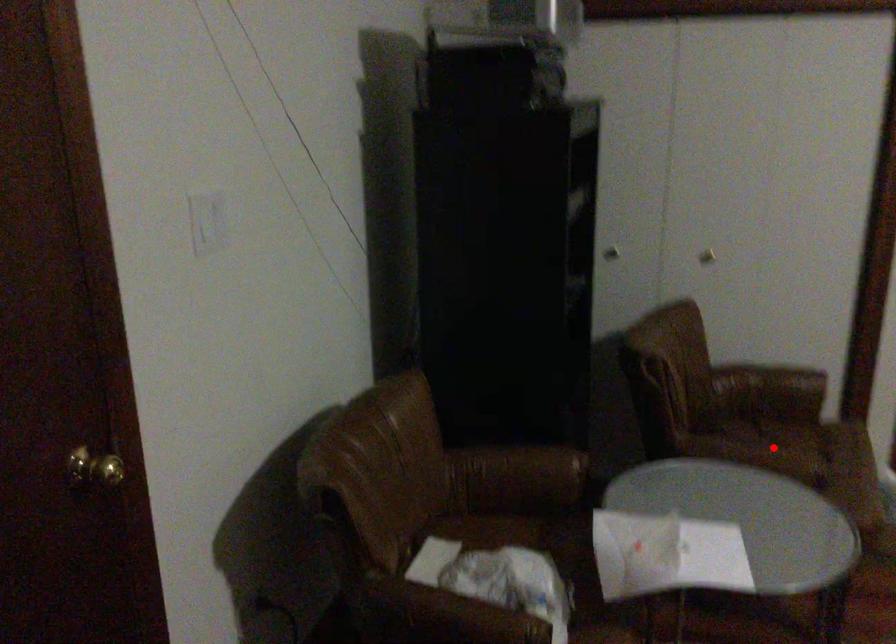
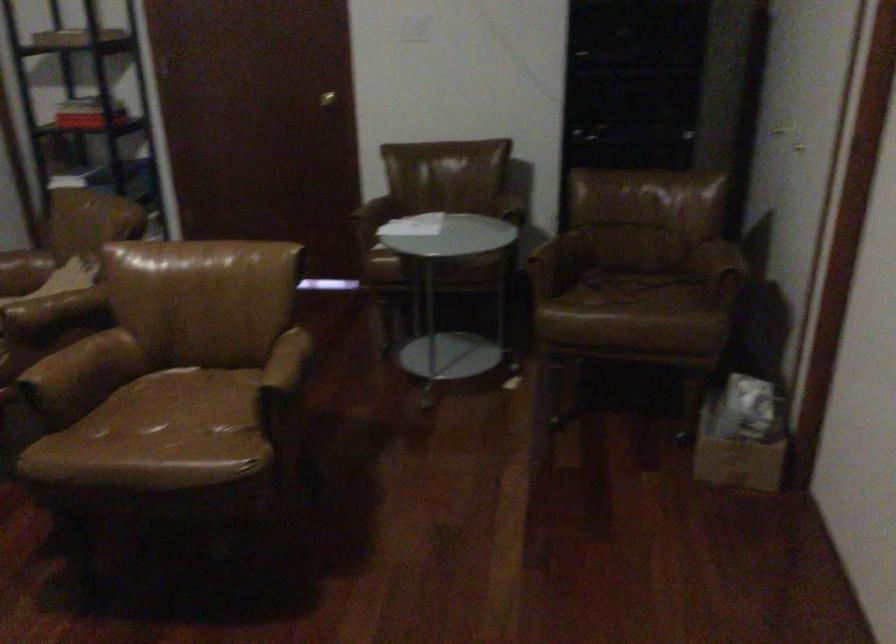
Question: I am providing you with two images of the same scene from different viewpoints. A red point is shown in image1. For the corresponding object point in image2, is it positioned nearer or farther from the camera?

Choices:
 (A) Nearer
 (B) Farther

Answer: (B)